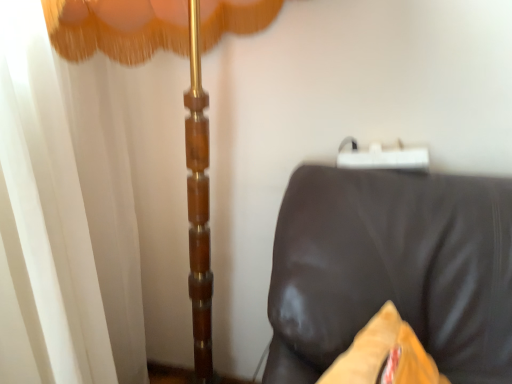
Question: Does point (61, 3) appear closer or farther from the camera than point (400, 185)?

Choices:
 (A) farther
 (B) closer

Answer: (B)

Question: Considering their positions, is white sheer curtain at left located in front of or behind brown leather couch at lower right?

Choices:
 (A) front
 (B) behind

Answer: (B)

Question: From the image's perspective, is white sheer curtain at left above or below brown leather couch at lower right?

Choices:
 (A) above
 (B) below

Answer: (A)

Question: Based on their positions, is brown leather couch at lower right located to the left or right of white sheer curtain at left?

Choices:
 (A) left
 (B) right

Answer: (B)

Question: Is point (265, 377) positioned closer to the camera than point (263, 14)?

Choices:
 (A) farther
 (B) closer

Answer: (B)

Question: Is brown leather couch at lower right in front of or behind white sheer curtain at left in the image?

Choices:
 (A) behind
 (B) front

Answer: (B)

Question: From a real-world perspective, is brown leather couch at lower right physically located above or below white sheer curtain at left?

Choices:
 (A) above
 (B) below

Answer: (B)